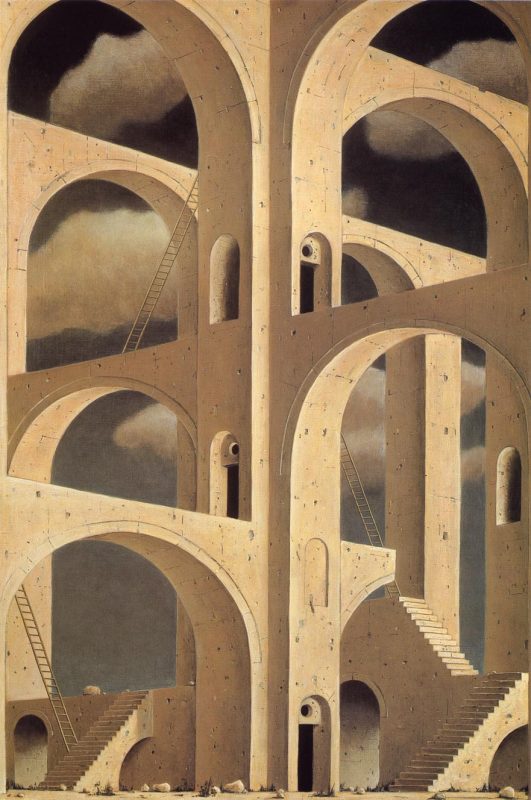
Identify the location of ladder. This screenshot has width=531, height=800. (32, 634), (347, 460), (171, 252).